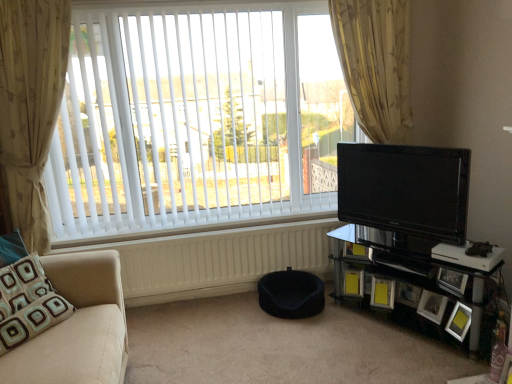
Identify the location of free space to the left of black fabric bean bag at center. The image size is (512, 384). (238, 315).